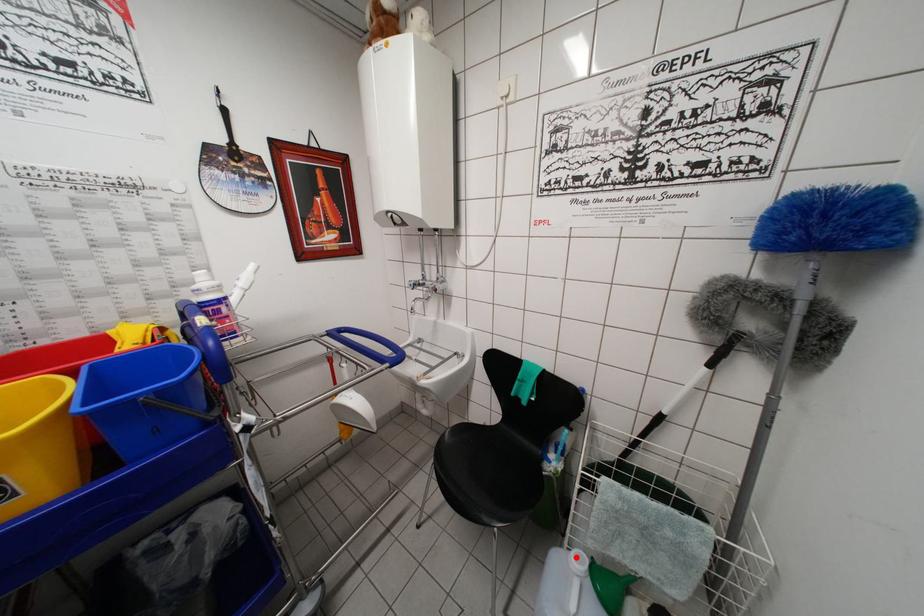
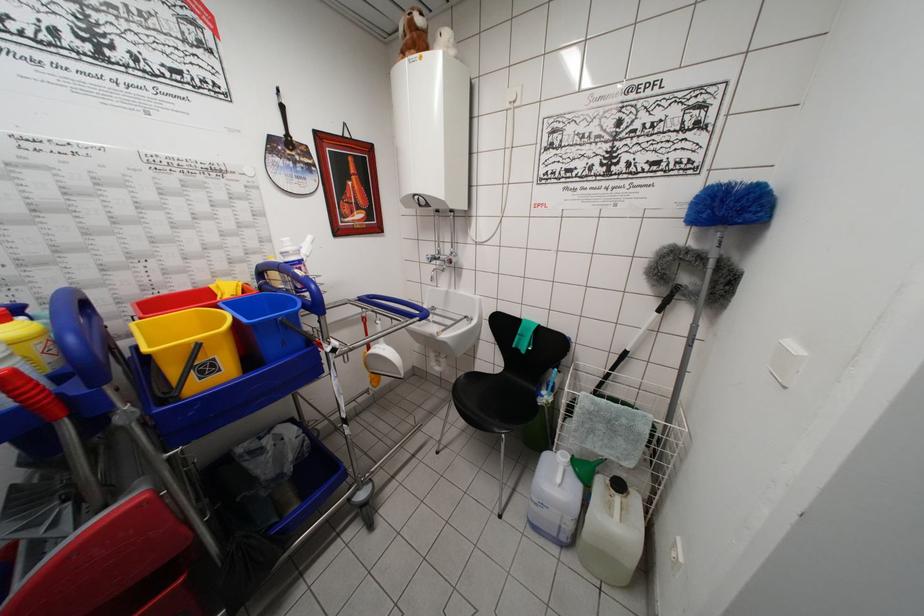
Question: I am providing you with two images of the same scene from different viewpoints. A red point is marked on the first image. Is the red point's position out of view in image 2?

Choices:
 (A) Yes
 (B) No

Answer: (B)